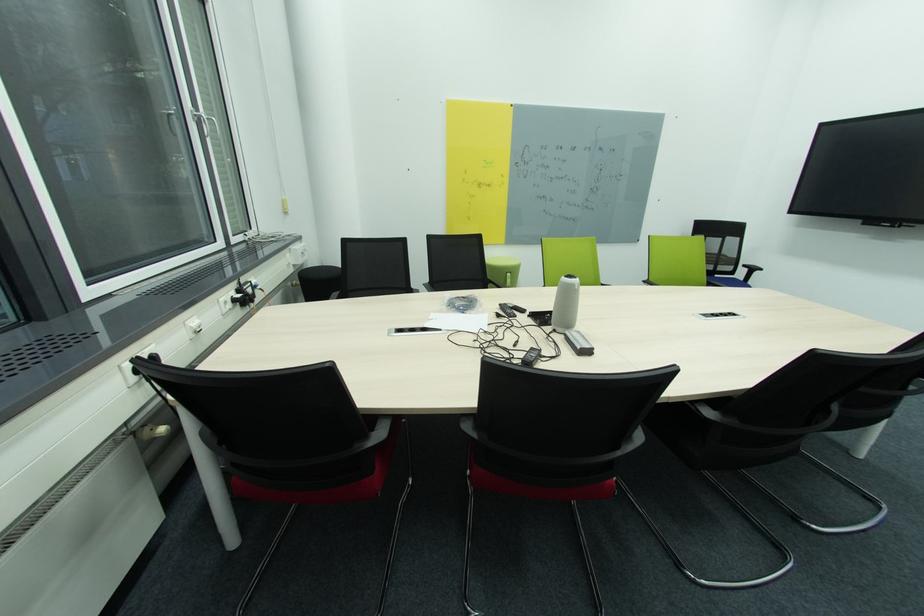
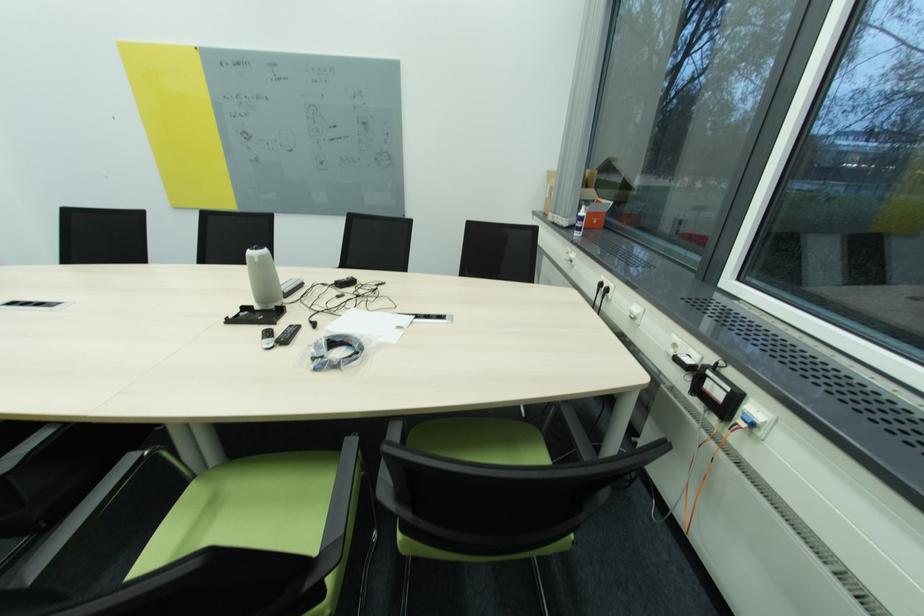
Locate, in the second image, the point that corresponds to pixel 519 317 in the first image.

(296, 328)